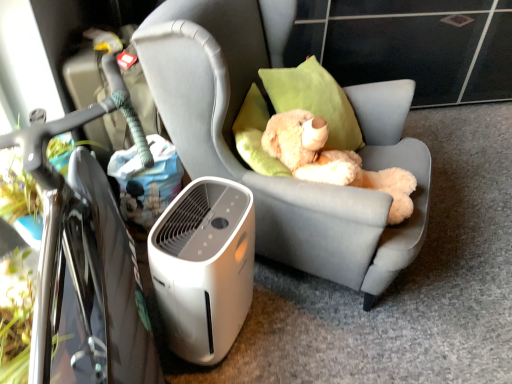
The image size is (512, 384). Find the location of `free space that is in between white plastic air purifier at lower left and light gray fabric chair at center`. free space that is in between white plastic air purifier at lower left and light gray fabric chair at center is located at coordinates (291, 347).